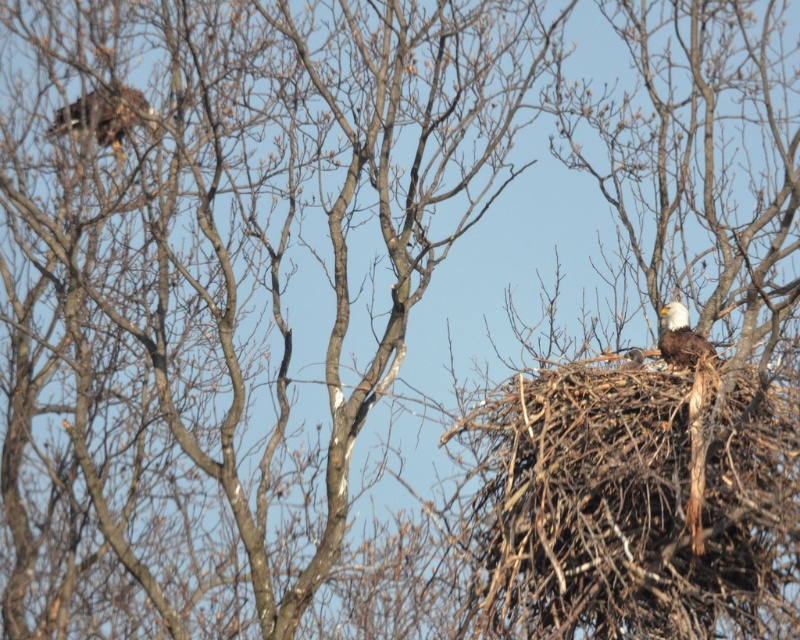
Based on the photo, you are a birdwatcher observing the large, leafless tree in the scene. You notice two eagles in the tree. Which eagle is positioned higher up in the tree, the brown textured eagle at upper left or the matte brown eagle at center?

The brown textured eagle at upper left is positioned higher up in the tree than the matte brown eagle at center.

You are a birdwatcher observing the matte brown eagle at center and the brown feathered eagle at upper right in the tree. Which eagle appears larger in the image?

The matte brown eagle at center appears much taller than the brown feathered eagle at upper right, making it the larger of the two.

You are a birdwatcher observing the scene. You notice the brown textured eagle at upper left. Based on its position coordinates, is it closer to the top edge or the bottom edge of the image?

The brown textured eagle at upper left is located at point 0.131 on the vertical axis, which is closer to the top edge of the image since the value is lower. In coordinate systems, lower y values correspond to positions higher up.